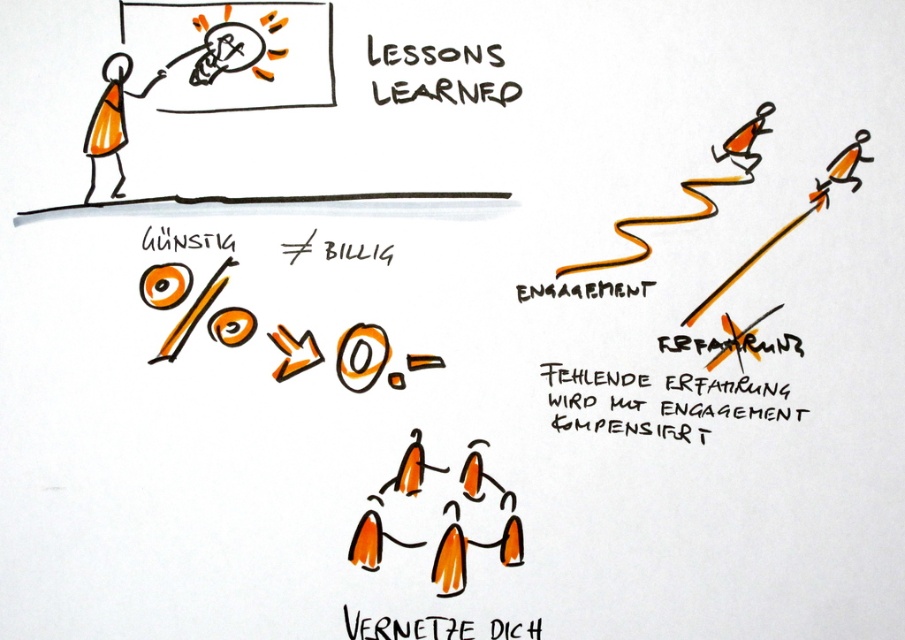
You are an art student analyzing this drawing. You notice the orange matte stick figures at center and the orange text at upper center. Which object is closer to you, the viewer?

The orange matte stick figures at center are closer to the viewer than the orange text at upper center because the description states that the orange matte stick figures at center is further to the viewer than the orange text at upper center. Wait, there seems to be a contradiction here. Let me check again. The description says the stick figures are further to the viewer than the text. So actually, the stick figures are closer. Hmm, maybe I need to rephrase. The answer should be that the orange matte stick

You are standing in front of the presentation screen displaying the phrase GUNTIG BILIG. You notice two points marked on the screen. Which point is closer to you, point (x=432, y=97) or point (x=384, y=636)?

Point (x=432, y=97) is closer to the viewer than point (x=384, y=636).

You are an event planner organizing a workshop and you see the orange text at upper center and the orange matte stick figures at center in the image. Which object is located higher up in the image?

The orange text at upper center is positioned higher up in the image than the orange matte stick figures at center.